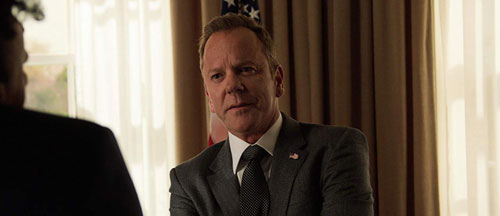
The height and width of the screenshot is (216, 500). Find the location of `white curtains`. white curtains is located at coordinates (140, 80), (460, 76).